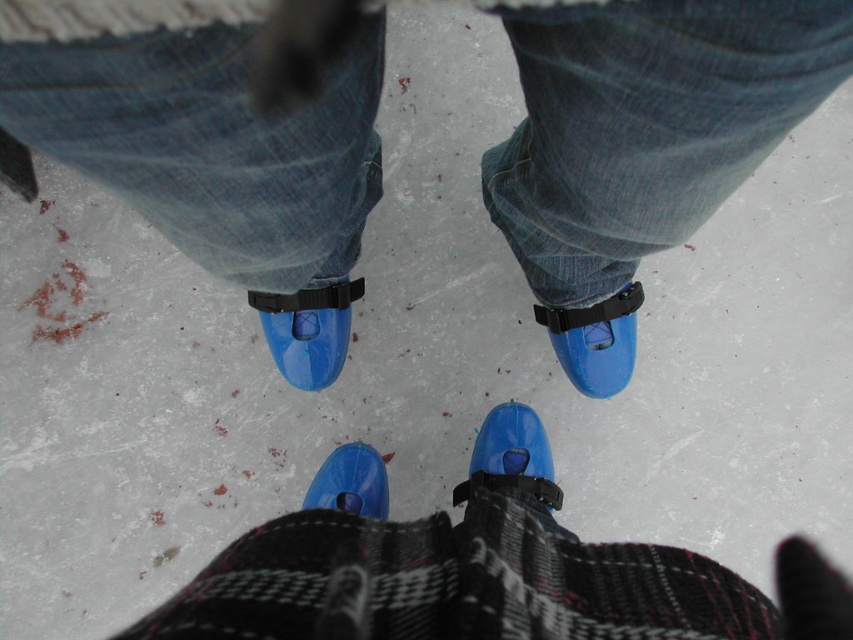
Based on the photo, is blue matte ice skate at center to the right of translucent blue ice skate at center from the viewer's perspective?

In fact, blue matte ice skate at center is to the left of translucent blue ice skate at center.

Locate an element on the screen. The height and width of the screenshot is (640, 853). blue matte ice skate at center is located at coordinates (308, 330).

Who is shorter, glossy plastic ice skates at center or blue rubber ice skate at center?

With less height is blue rubber ice skate at center.

Does glossy plastic ice skates at center have a greater height compared to blue rubber ice skate at center?

Yes.

Describe the element at coordinates (212, 120) in the screenshot. I see `glossy plastic ice skates at center` at that location.

Find the location of a particular element. This screenshot has height=640, width=853. glossy plastic ice skates at center is located at coordinates (212, 120).

Who is lower down, blue matte ice skate at center or blue plastic ice skate at center?

Positioned lower is blue plastic ice skate at center.

Is blue matte ice skate at center smaller than blue plastic ice skate at center?

Incorrect, blue matte ice skate at center is not smaller in size than blue plastic ice skate at center.

Describe the element at coordinates (308, 330) in the screenshot. I see `blue matte ice skate at center` at that location.

Image resolution: width=853 pixels, height=640 pixels. I want to click on blue matte ice skate at center, so click(308, 330).